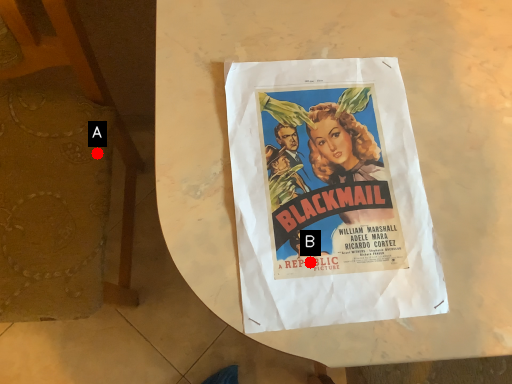
Question: Two points are circled on the image, labeled by A and B beside each circle. Which of the following is the closest to the observer?

Choices:
 (A) A is closer
 (B) B is closer

Answer: (B)